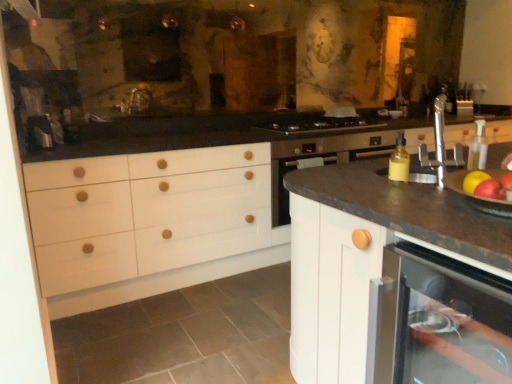
Question: Is matte white dishwasher at lower right smaller than white matte cabinet at center?

Choices:
 (A) yes
 (B) no

Answer: (A)

Question: From the image's perspective, does matte white dishwasher at lower right appear lower than white matte cabinet at center?

Choices:
 (A) yes
 (B) no

Answer: (A)

Question: Is matte white dishwasher at lower right taller than white matte cabinet at center?

Choices:
 (A) yes
 (B) no

Answer: (B)

Question: Considering the relative sizes of matte white dishwasher at lower right and white matte cabinet at center in the image provided, is matte white dishwasher at lower right shorter than white matte cabinet at center?

Choices:
 (A) yes
 (B) no

Answer: (A)

Question: Are matte white dishwasher at lower right and white matte cabinet at center located far from each other?

Choices:
 (A) yes
 (B) no

Answer: (B)

Question: In terms of width, does shiny red apple at right, arranged as the 1th apple when viewed from the back, look wider or thinner when compared to red matte apple at right, which is the 1th apple from front to back?

Choices:
 (A) thin
 (B) wide

Answer: (B)

Question: In the image, is shiny red apple at right, which ranks as the second apple in front-to-back order, positioned in front of or behind red matte apple at right, the second apple from the back?

Choices:
 (A) front
 (B) behind

Answer: (B)

Question: From a real-world perspective, is shiny red apple at right, arranged as the 1th apple when viewed from the back, physically located above or below red matte apple at right, the second apple from the back?

Choices:
 (A) below
 (B) above

Answer: (A)

Question: Would you say shiny red apple at right, arranged as the 1th apple when viewed from the back, is to the left or to the right of red matte apple at right, the second apple from the back, in the picture?

Choices:
 (A) right
 (B) left

Answer: (A)

Question: Considering the positions of matte white dishwasher at lower right and stainless steel gas stove at center in the image, is matte white dishwasher at lower right wider or thinner than stainless steel gas stove at center?

Choices:
 (A) wide
 (B) thin

Answer: (A)

Question: Considering the positions of matte white dishwasher at lower right and stainless steel gas stove at center in the image, is matte white dishwasher at lower right taller or shorter than stainless steel gas stove at center?

Choices:
 (A) short
 (B) tall

Answer: (B)

Question: From the image's perspective, is matte white dishwasher at lower right positioned above or below stainless steel gas stove at center?

Choices:
 (A) above
 (B) below

Answer: (B)

Question: Is matte white dishwasher at lower right spatially inside stainless steel gas stove at center, or outside of it?

Choices:
 (A) inside
 (B) outside

Answer: (B)

Question: In the image, is yellow matte bottle at right positioned in front of or behind stainless steel gas stove at center?

Choices:
 (A) behind
 (B) front

Answer: (B)

Question: Considering the positions of point (394, 175) and point (295, 132), is point (394, 175) closer or farther from the camera than point (295, 132)?

Choices:
 (A) closer
 (B) farther

Answer: (A)